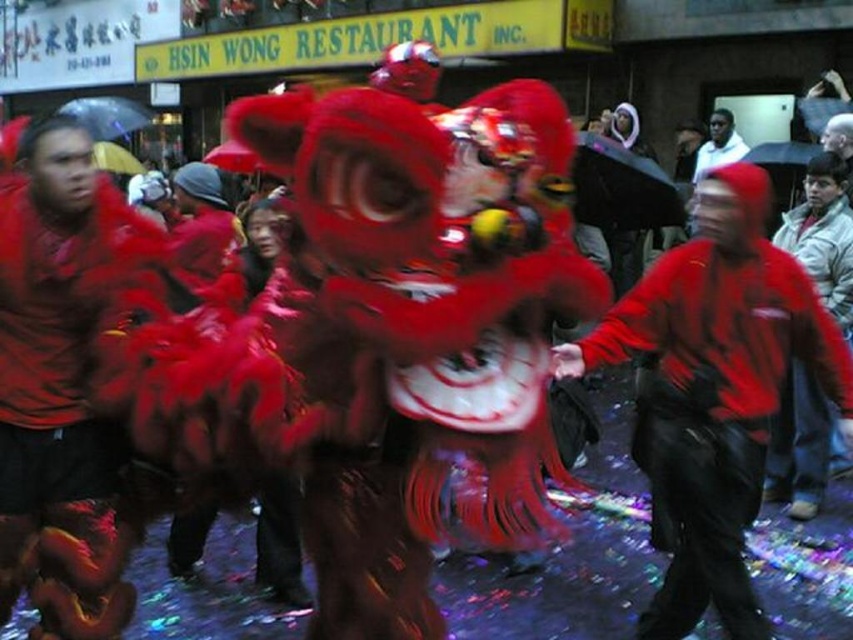
Between point (811, 384) and point (744, 147), which one is positioned behind?

The point (744, 147) is more distant.

From the picture: Is red matte jacket at right positioned at the back of white cotton hoodie at upper center?

That is False.

Which is behind, point (788, 224) or point (711, 131)?

The point (711, 131) is more distant.

Find the location of a particular element. The height and width of the screenshot is (640, 853). red matte jacket at right is located at coordinates (822, 236).

Who is positioned more to the right, matte red jacket at center or velvet red lion at center?

From the viewer's perspective, matte red jacket at center appears more on the right side.

Where is `matte red jacket at center`? matte red jacket at center is located at coordinates (712, 392).

The height and width of the screenshot is (640, 853). I want to click on matte red jacket at center, so click(x=712, y=392).

Between velvet red lion at center and red matte jacket at right, which one is positioned higher?

red matte jacket at right is above.

Does velvet red lion at center have a lesser height compared to red matte jacket at right?

Incorrect, velvet red lion at center's height does not fall short of red matte jacket at right's.

Does point (68, 440) come closer to viewer compared to point (817, 436)?

That is True.

Identify the location of velvet red lion at center. Image resolution: width=853 pixels, height=640 pixels. (61, 381).